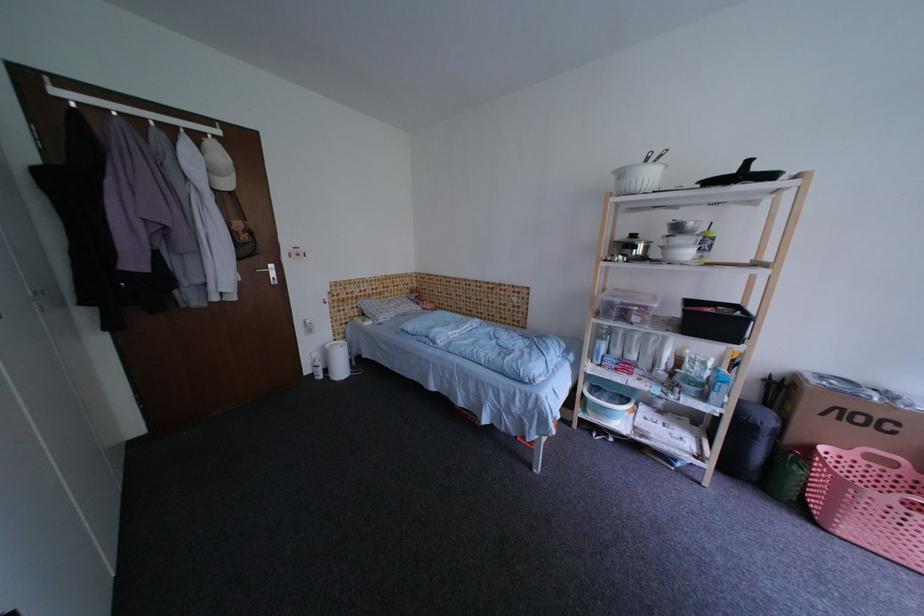
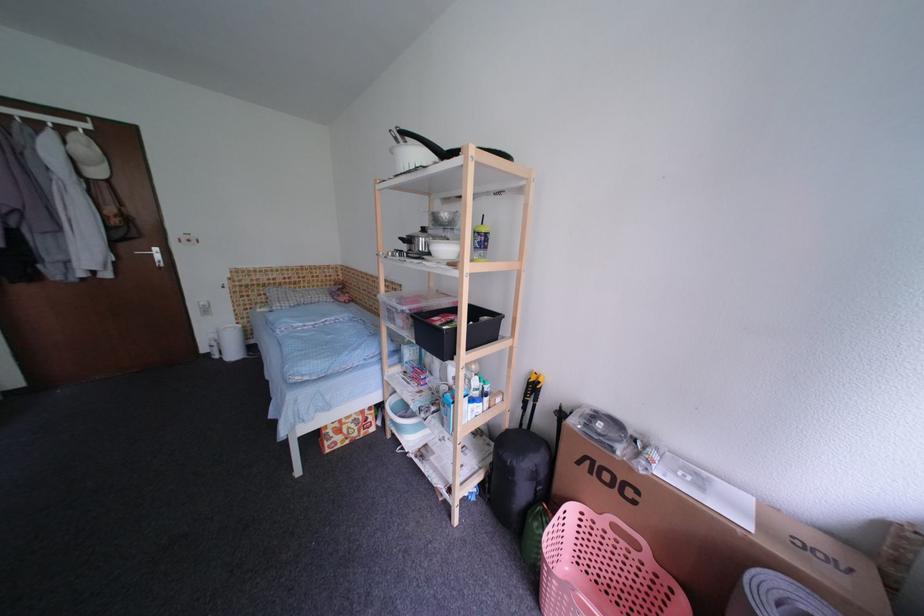
Locate, in the second image, the point that corresponds to (x=699, y=227) in the first image.

(453, 217)